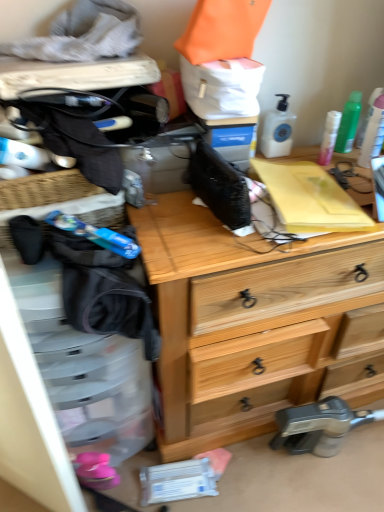
Where is `free spot behind pink matte lotion at upper right, the 3th toiletry viewed from the right`? The height and width of the screenshot is (512, 384). free spot behind pink matte lotion at upper right, the 3th toiletry viewed from the right is located at coordinates (310, 152).